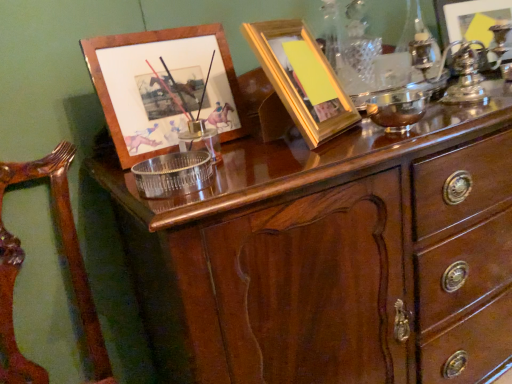
Question: Considering their positions, is metallic silver picture frame at upper right, acting as the 3th picture frame starting from the left, located in front of or behind mahogany wood chest of drawers at upper center?

Choices:
 (A) behind
 (B) front

Answer: (A)

Question: Based on their positions, is metallic silver picture frame at upper right, positioned as the third picture frame in front-to-back order, located to the left or right of mahogany wood chest of drawers at upper center?

Choices:
 (A) left
 (B) right

Answer: (B)

Question: Which object is positioned closest to the wooden armchair at left?

Choices:
 (A) mahogany wood chest of drawers at upper center
 (B) metallic silver picture frame at upper right, acting as the 3th picture frame starting from the left
 (C) yellow matte picture frame at upper center, the 2th picture frame from the right
 (D) wooden picture frame at upper left, placed as the 2th picture frame when sorted from front to back

Answer: (D)

Question: Estimate the real-world distances between objects in this image. Which object is closer to the mahogany wood chest of drawers at upper center?

Choices:
 (A) wooden armchair at left
 (B) yellow matte picture frame at upper center, the 1th picture frame when ordered from front to back
 (C) metallic silver picture frame at upper right, positioned as the third picture frame in front-to-back order
 (D) wooden picture frame at upper left, placed as the 2th picture frame when sorted from front to back

Answer: (B)